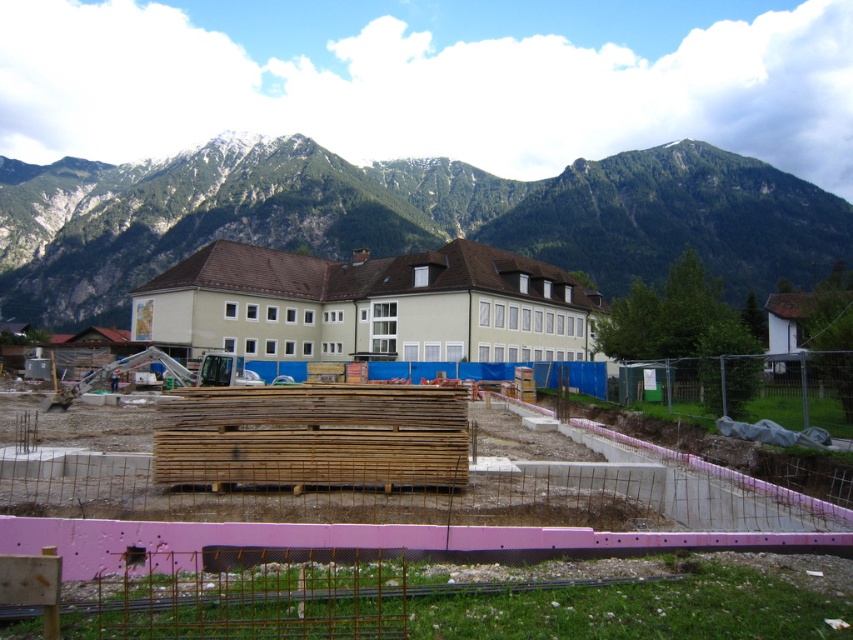
You are standing at the construction site with a 30 meter long safety rope. You need to secure a safety line to the point at coordinates point (10, 456). Is the rope long enough to reach that point?

The point at coordinates point (10, 456) is 26.47 meters away from the viewer. Since the safety rope is 30 meters long, it is long enough to reach the point.

You are a construction worker who needs to move a heavy equipment from the wooden planks at center to the green rocky mountains at upper center. Considering their sizes, which object would be more challenging to navigate over?

The green rocky mountains at upper center would be more challenging to navigate over because they are larger than the wooden planks at center.